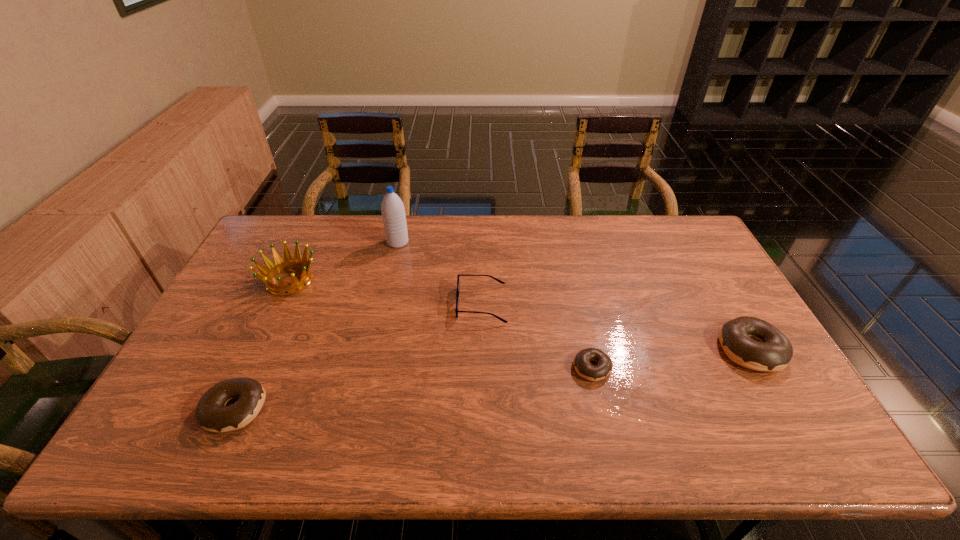
Where is `free spot between the crown and the second tallest doughnut`? This screenshot has height=540, width=960. free spot between the crown and the second tallest doughnut is located at coordinates (262, 345).

Where is `free space between the second object from right to left and the fourth object from right to left`? free space between the second object from right to left and the fourth object from right to left is located at coordinates (495, 305).

The height and width of the screenshot is (540, 960). Identify the location of vacant space in between the spectacles and the farthest object. (440, 273).

Identify the location of free spot between the second shortest doughnut and the spectacles. pos(358,356).

Locate an element on the screen. vacant point located between the spectacles and the shortest doughnut is located at coordinates (537, 336).

Where is `vacant area between the water bottle and the fourth object from left to right`? The image size is (960, 540). vacant area between the water bottle and the fourth object from left to right is located at coordinates (440, 273).

Locate an element on the screen. Image resolution: width=960 pixels, height=540 pixels. vacant point located between the second shortest doughnut and the third object from left to right is located at coordinates (316, 326).

Locate an element on the screen. empty space that is in between the leftmost doughnut and the rightmost doughnut is located at coordinates (492, 379).

Point out which object is positioned as the fourth nearest to the second tallest doughnut. Please provide its 2D coordinates. Your answer should be formatted as a tuple, i.e. [(x, y)], where the tuple contains the x and y coordinates of a point satisfying the conditions above.

[(583, 367)]

The height and width of the screenshot is (540, 960). What are the coordinates of `the fifth closest object to the crown` in the screenshot? It's located at point(772,351).